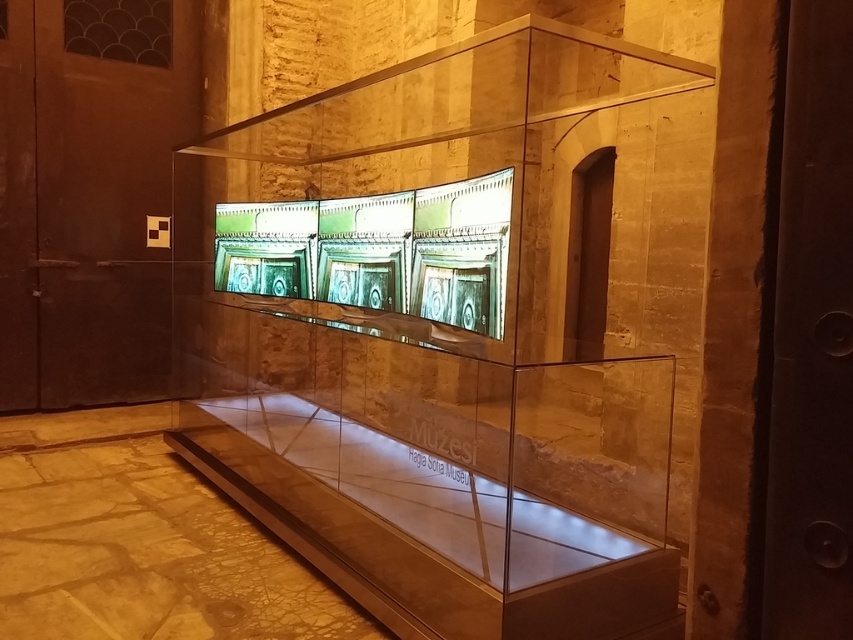
You are a visitor in the museum and want to take a photo of both the transparent glass display case at center and the transparent glass table at center. Which object should you focus on first to ensure both are in the frame?

You should focus on the transparent glass display case at center first because it is closer to the viewer than the transparent glass table at center, so adjusting the camera to include both would require starting with the closer object.

From the picture: You are a tour guide leading a group through this museum. You need to move a large painting that is 1.8 meters wide from the entrance to the storage room. The only path available goes past the transparent glass display case at center and the brown wooden door at left. Will the painting fit through the door without being rotated?

The transparent glass display case at center is wider than the brown wooden door at left. Since the painting is 1.8 meters wide, and the door is narrower than the display case, the painting may not fit through the door without being rotated.

You are a visitor in the museum and want to take a photo of both the transparent glass display case at center and the transparent glass table at center without any obstruction. Which object should you position yourself closer to in order to ensure both are fully visible in the frame?

Result: Since the transparent glass display case at center is taller than the transparent glass table at center, you should position yourself closer to the transparent glass table at center to ensure both objects are fully visible in the frame without any obstruction caused by the height difference.